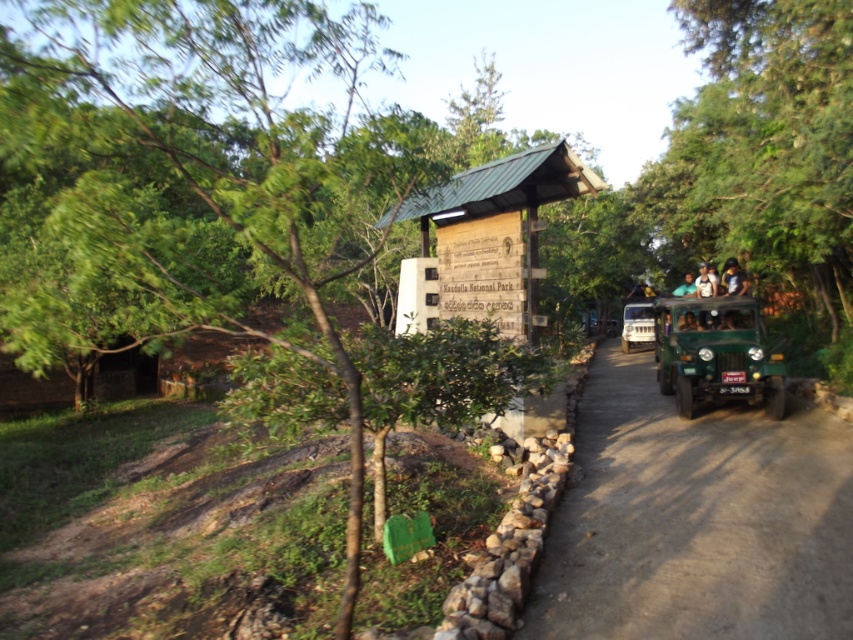
Question: Which object is the closest to the blurred plastic head at upper center?

Choices:
 (A) metallic green jeep at center
 (B) light brown leather jacket at upper center
 (C) dirt road at center
 (D) green leafy tree at center

Answer: (A)

Question: Which object is the farthest from the light brown leather jacket at upper center?

Choices:
 (A) blurred plastic head at upper center
 (B) dirt road at center
 (C) metallic green jeep at center

Answer: (C)

Question: Does green leafy tree at center appear on the right side of metallic green jeep at center?

Choices:
 (A) no
 (B) yes

Answer: (A)

Question: Does dirt road at center have a smaller size compared to green fabric person at center?

Choices:
 (A) yes
 (B) no

Answer: (B)

Question: Is metallic green jeep at center further to the viewer compared to green fabric person at center?

Choices:
 (A) no
 (B) yes

Answer: (B)

Question: Estimate the real-world distances between objects in this image. Which object is closer to the wooden sign at center?

Choices:
 (A) green matte jeep at right
 (B) dirt road at center
 (C) blurred plastic head at upper center

Answer: (B)